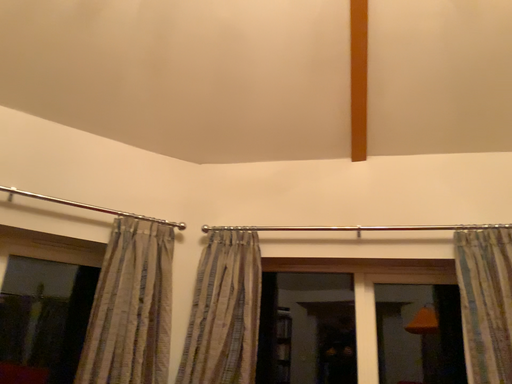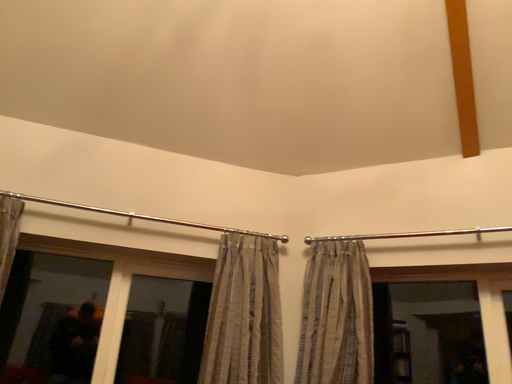
Question: Which way did the camera rotate in the video?

Choices:
 (A) rotated left
 (B) rotated right

Answer: (A)